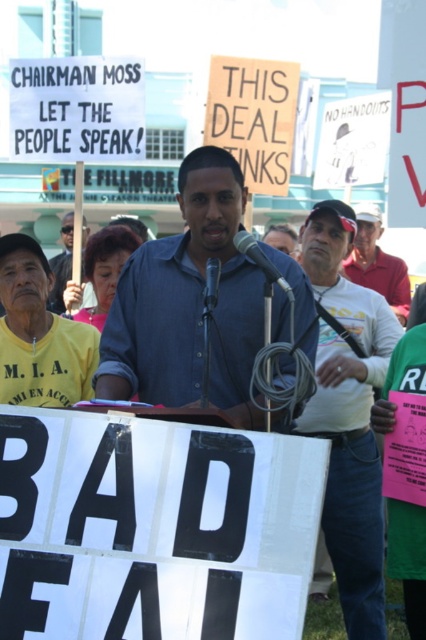
Between blue denim shirt at center and white cotton shirt at center, which one is positioned lower?

Positioned lower is white cotton shirt at center.

Who is more forward, (138, 320) or (348, 456)?

Point (138, 320) is more forward.

Is point (247, 406) positioned before point (347, 349)?

Yes, point (247, 406) is closer to viewer.

The image size is (426, 640). In order to click on blue denim shirt at center in this screenshot , I will do `click(187, 304)`.

Does point (259, 296) lie in front of point (394, 266)?

Yes, point (259, 296) is in front of point (394, 266).

Does point (285, 378) come farther from viewer compared to point (371, 234)?

No, (285, 378) is in front of (371, 234).

This screenshot has height=640, width=426. I want to click on blue denim shirt at center, so [187, 304].

Can you confirm if white cotton shirt at center is positioned below matte blue shirt at center?

Indeed, white cotton shirt at center is positioned under matte blue shirt at center.

Locate an element on the screen. The width and height of the screenshot is (426, 640). white cotton shirt at center is located at coordinates (348, 416).

Locate an element on the screen. The image size is (426, 640). white cotton shirt at center is located at coordinates (348, 416).